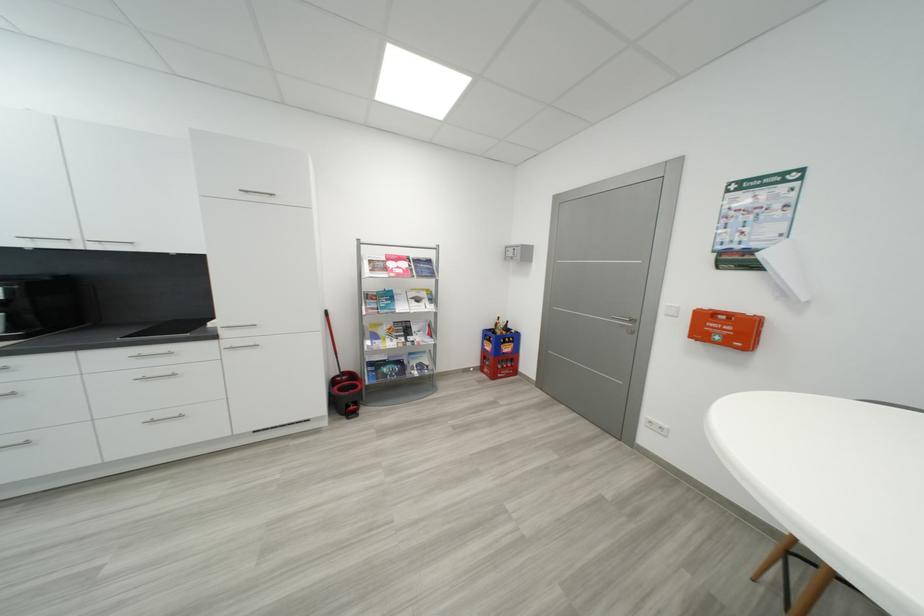
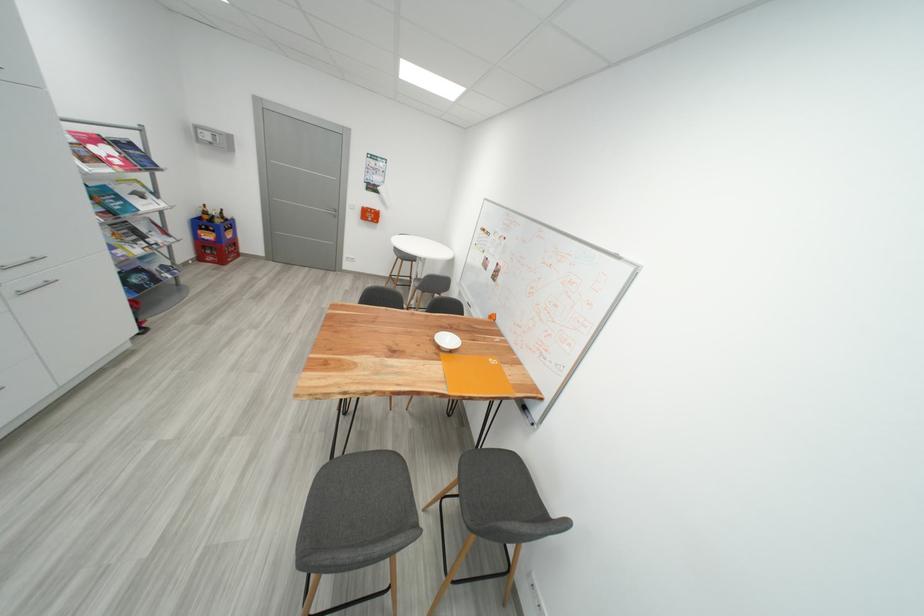
In the second image, find the point that corresponds to the point at 497,331 in the first image.

(208, 220)